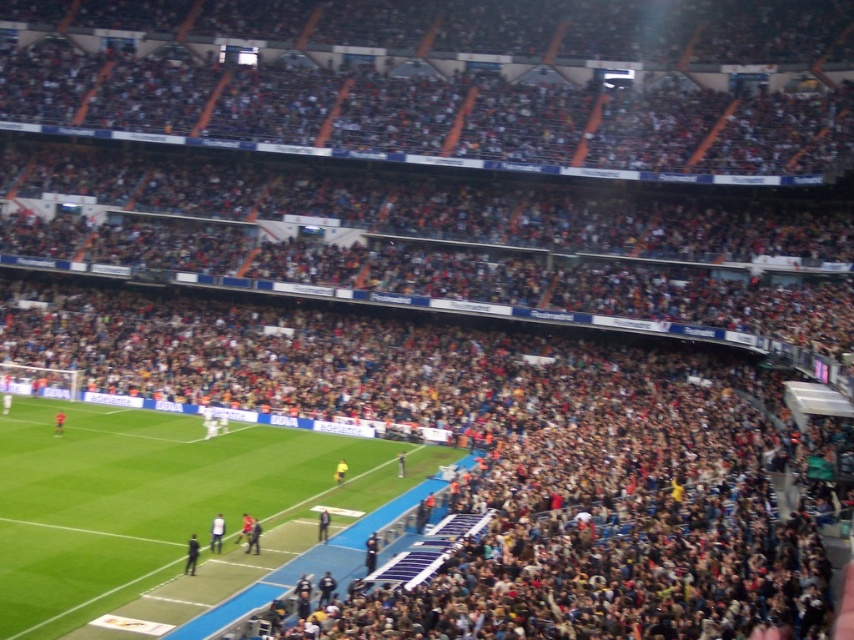
Question: Is dark blue uniform at center further to camera compared to yellow fabric person at center?

Choices:
 (A) yes
 (B) no

Answer: (B)

Question: Observing the image, what is the correct spatial positioning of dark blue suit at lower center in reference to yellow jersey at center?

Choices:
 (A) above
 (B) below

Answer: (A)

Question: Among these objects, which one is nearest to the camera?

Choices:
 (A) orange jersey at center
 (B) yellow fabric person at center

Answer: (B)

Question: In this image, where is white matte shirt at lower left located relative to dark blue suit at lower center?

Choices:
 (A) below
 (B) above

Answer: (B)

Question: Which point appears farthest from the camera in this image?

Choices:
 (A) (192, 563)
 (B) (341, 460)
 (C) (211, 538)

Answer: (B)

Question: Which point is farther from the camera taking this photo?

Choices:
 (A) (57, 429)
 (B) (115, 432)

Answer: (B)